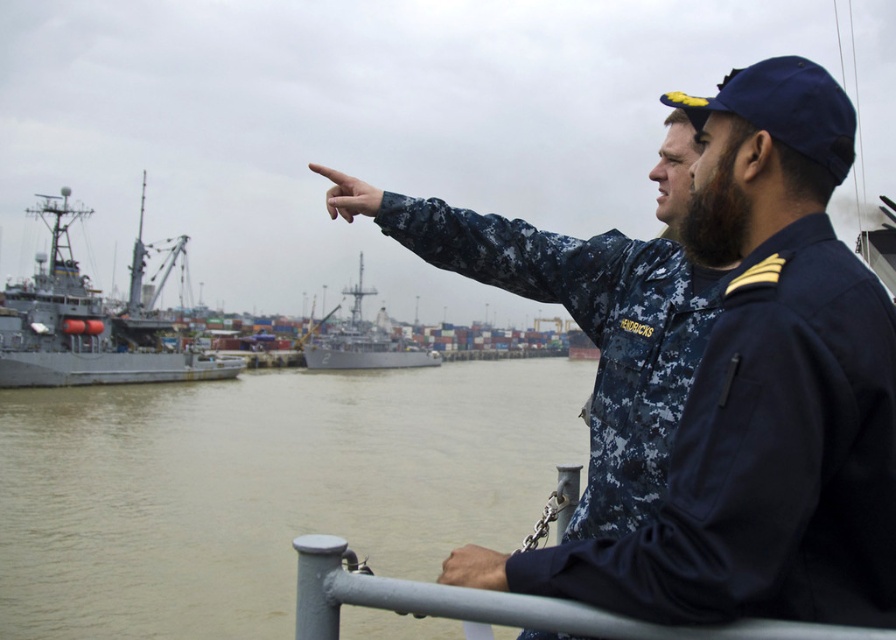
Question: Among these points, which one is nearest to the camera?

Choices:
 (A) (478, 554)
 (B) (674, 604)
 (C) (640, 397)
 (D) (360, 188)

Answer: (B)

Question: Is brown murky water at center below gray metallic ship at center?

Choices:
 (A) no
 (B) yes

Answer: (B)

Question: Which point is farther to the camera?

Choices:
 (A) (556, 248)
 (B) (369, 193)
 (C) (800, 632)

Answer: (A)

Question: Can you confirm if digital camouflage uniform at center is bigger than gray metallic ship at center?

Choices:
 (A) no
 (B) yes

Answer: (A)

Question: Can you confirm if brown murky water at center is positioned below skinny tan hand at center?

Choices:
 (A) no
 (B) yes

Answer: (B)

Question: Which of the following is the farthest from the observer?

Choices:
 (A) (371, 188)
 (B) (888, 378)

Answer: (A)